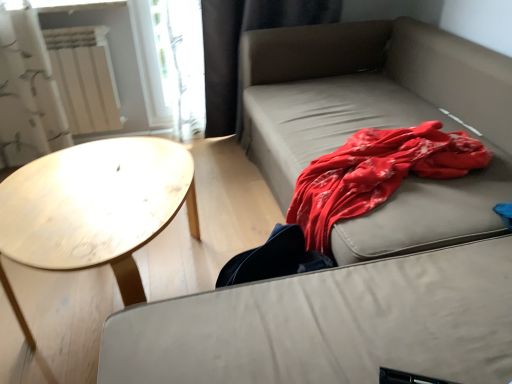
Find the location of a particular element. This screenshot has height=384, width=512. vacant region above light wood/texture coffee table at left (from a real-world perspective) is located at coordinates (97, 188).